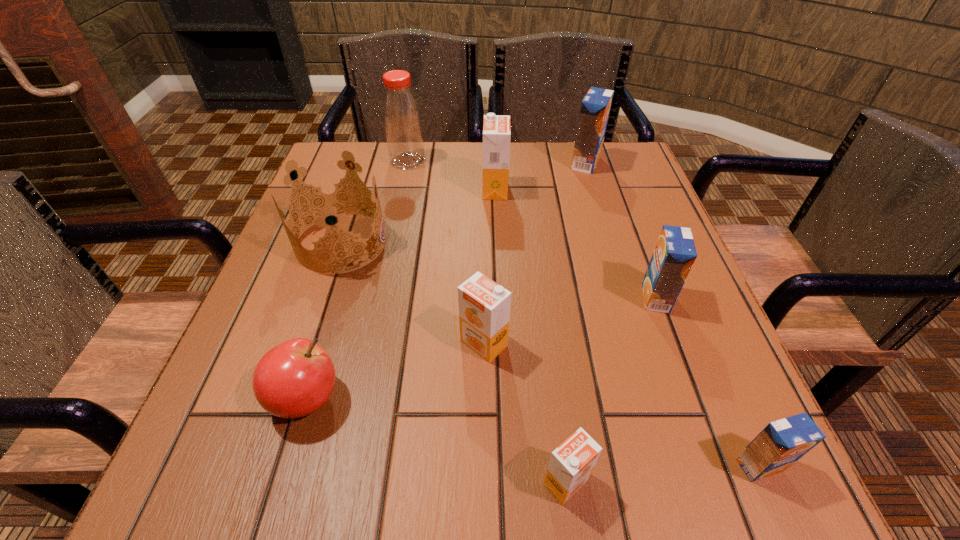
You are a GUI agent. You are given a task and a screenshot of the screen. Output one action in this format:
    pyautogui.click(x=<x>, y=<y>)
    Task: Click on the free space located on the back of the second farthest blue orange_juice
    The height and width of the screenshot is (540, 960).
    Given the screenshot: What is the action you would take?
    pyautogui.click(x=634, y=238)

This screenshot has width=960, height=540. Find the location of `vacant region located 0.240m on the back of the second farthest orange orange juice`. vacant region located 0.240m on the back of the second farthest orange orange juice is located at coordinates (483, 237).

The height and width of the screenshot is (540, 960). Identify the location of vacant point located 0.070m on the back of the red apple. (325, 333).

The width and height of the screenshot is (960, 540). I want to click on vacant region located on the left of the nearest blue orange_juice, so click(651, 465).

This screenshot has width=960, height=540. Find the location of `vacant space located 0.050m on the back of the nearest orange orange juice`. vacant space located 0.050m on the back of the nearest orange orange juice is located at coordinates (559, 427).

Locate an element on the screen. bottle that is at the far edge is located at coordinates (401, 114).

This screenshot has height=540, width=960. I want to click on crown present at the left edge, so click(328, 202).

Locate an element on the screen. The width and height of the screenshot is (960, 540). apple that is positioned at the left edge is located at coordinates click(295, 378).

This screenshot has height=540, width=960. Identify the location of object that is at the far right corner. (595, 107).

Where is `object that is at the near right corner`? Image resolution: width=960 pixels, height=540 pixels. object that is at the near right corner is located at coordinates 781,443.